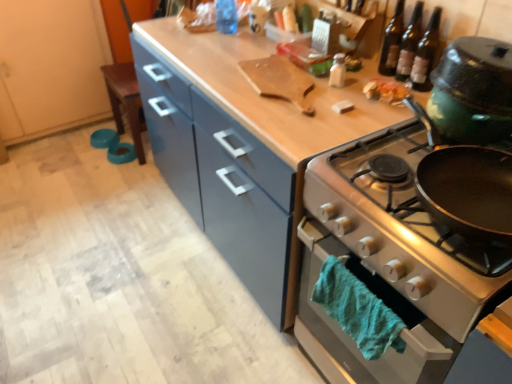
Find the location of a particular element. The image size is (512, 384). free space to the back side of white matte salt shaker at center, which is counted as the 2th bottle, starting from the back is located at coordinates (318, 73).